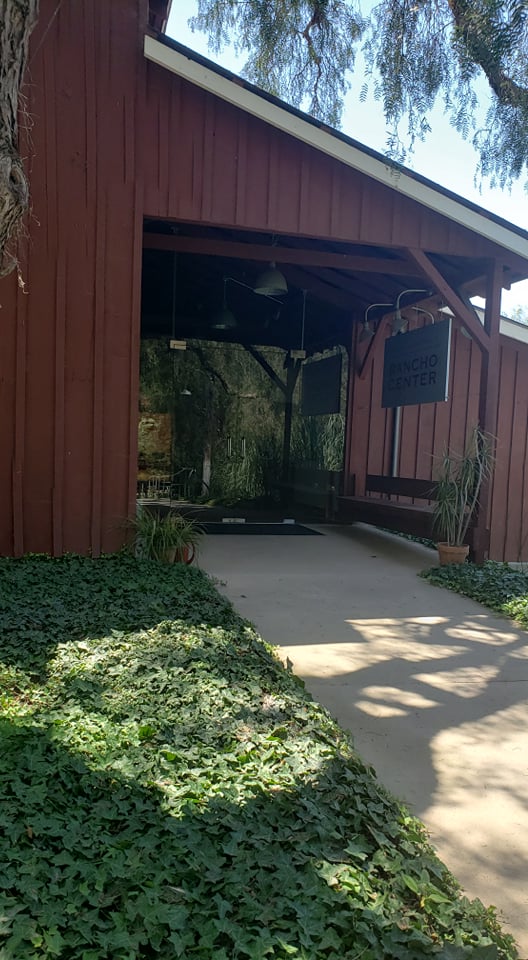
At what (x,y) coordinates should I click in order to perform the action: click on potted plants. Please return your answer as a coordinate pair (x, y). The width and height of the screenshot is (528, 960). Looking at the image, I should click on (166, 536), (183, 536), (464, 499).